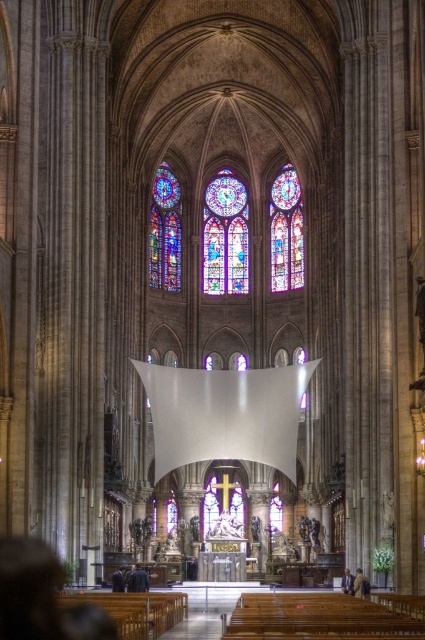
You are standing at the camera position in the cathedral. The multicolored stained glass at upper center is a key feature you want to photograph. Considering the distance between you and the stained glass, can you capture the entire stained glass in one shot without moving? Explain your reasoning.

The multicolored stained glass at upper center and camera are 138.80 meters apart from each other. At this distance, capturing the entire stained glass in one shot without moving would require a wide enough lens or adjusting the camera settings to ensure the entire subject fits within the frame. However, standard camera lenses might struggle with such a long distance, so specialized equipment or techniques might be necessary.